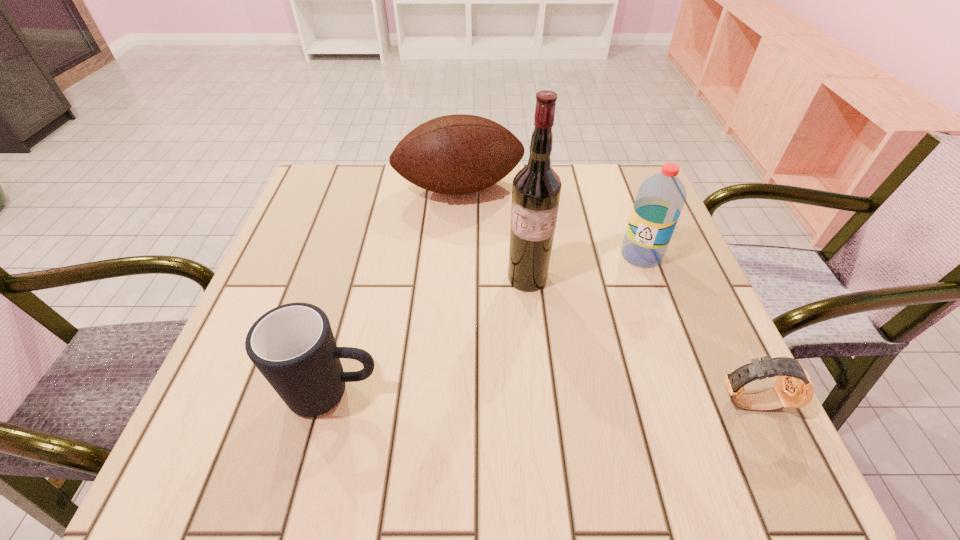
Where is `the second shortest object`? The image size is (960, 540). the second shortest object is located at coordinates (292, 345).

Where is `the shortest object`? the shortest object is located at coordinates (794, 388).

You are a GUI agent. You are given a task and a screenshot of the screen. Output one action in this format:
    pyautogui.click(x=<x>, y=<y>)
    Task: Click on the wine bottle
    
    Given the screenshot: What is the action you would take?
    pyautogui.click(x=536, y=191)

This screenshot has width=960, height=540. In order to click on water bottle in this screenshot , I will do `click(660, 199)`.

Find the location of a particular element. football is located at coordinates (455, 154).

Locate an element on the screen. The image size is (960, 540). free space located on the side of the second shortest object with the handle is located at coordinates (448, 393).

Locate an element on the screen. The width and height of the screenshot is (960, 540). vacant space positioned on the front and back of the tallest object is located at coordinates (520, 311).

The height and width of the screenshot is (540, 960). Find the location of `vacant space located on the front and back of the tallest object`. vacant space located on the front and back of the tallest object is located at coordinates (513, 348).

The image size is (960, 540). I want to click on free space located on the front and back of the tallest object, so click(x=507, y=376).

The image size is (960, 540). Identify the location of free space located on the front label of the water bottle. (593, 305).